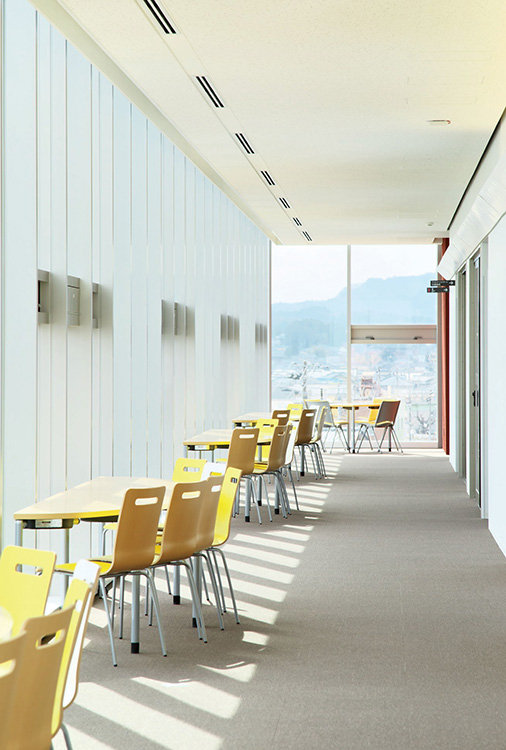
Locate an element on the screen. This screenshot has height=750, width=506. vents is located at coordinates tap(170, 27), tap(209, 96), tap(239, 141), tap(266, 178), tap(279, 198), tap(297, 220), tap(308, 236).